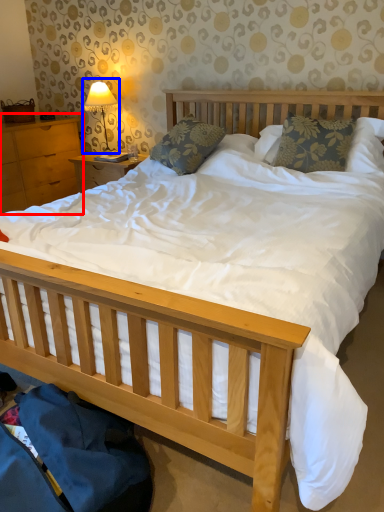
Question: Among these objects, which one is nearest to the camera, nightstand (highlighted by a red box) or table lamp (highlighted by a blue box)?

Choices:
 (A) nightstand
 (B) table lamp

Answer: (A)